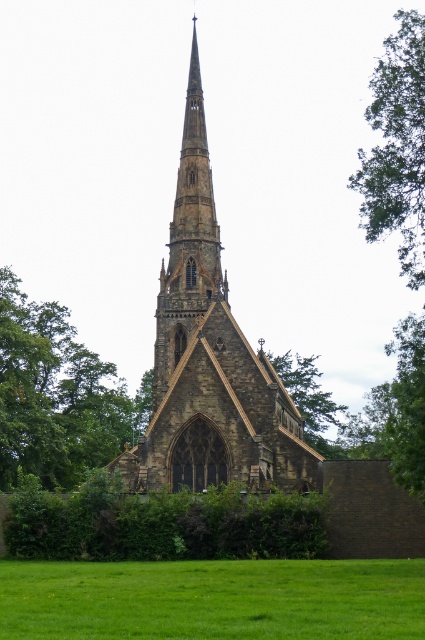
Question: Considering the relative positions of brown stone church at center and green grass at lower center in the image provided, where is brown stone church at center located with respect to green grass at lower center?

Choices:
 (A) right
 (B) left

Answer: (A)

Question: Estimate the real-world distances between objects in this image. Which object is closer to the green leafy tree at lower right?

Choices:
 (A) green leafy tree at center
 (B) brown stone church at center
 (C) green leafy tree at upper right

Answer: (B)

Question: Which point is closer to the camera?

Choices:
 (A) green leafy tree at upper right
 (B) brown stone church at center
 (C) green grass at lower center
 (D) green leafy tree at center

Answer: (C)

Question: Estimate the real-world distances between objects in this image. Which object is farther from the green grass at lower center?

Choices:
 (A) green leafy tree at center
 (B) green leafy tree at lower right
 (C) brown stone church at center
 (D) green leafy tree at upper right

Answer: (B)

Question: Is brown stone church at center to the right of green leafy tree at lower right from the viewer's perspective?

Choices:
 (A) yes
 (B) no

Answer: (B)

Question: Is green grass at lower center bigger than green leafy tree at center?

Choices:
 (A) yes
 (B) no

Answer: (B)